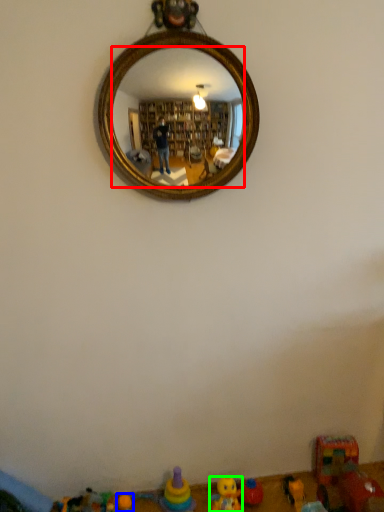
Question: Which object is positioned farthest from mirror (highlighted by a red box)? Select from toy (highlighted by a blue box) and toy (highlighted by a green box).

Choices:
 (A) toy
 (B) toy

Answer: (A)